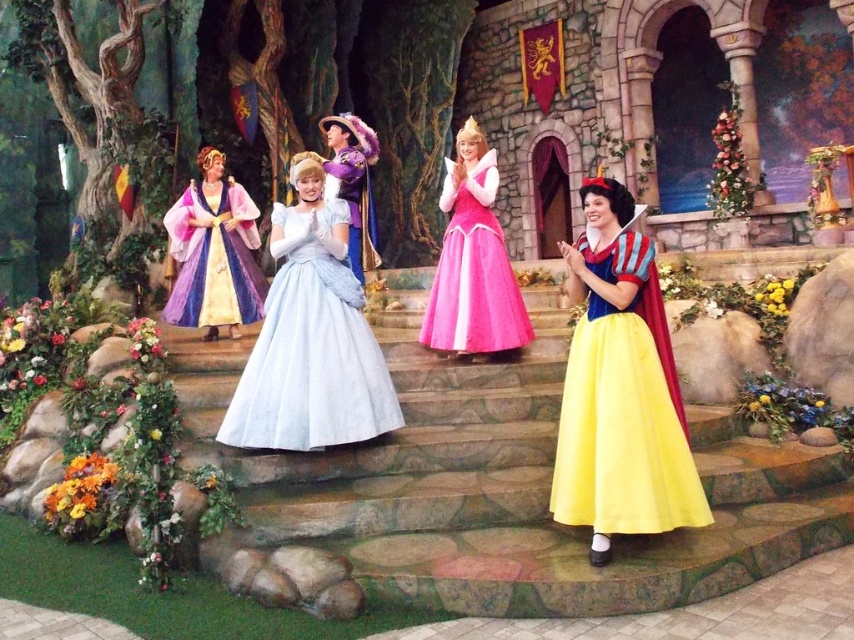
You are a photographer at the event and want to ensure both the yellow satin dress at center and the light blue satin dress at center are fully visible in your photo. Given their sizes, which dress might require you to adjust your camera angle to capture its entirety?

The light blue satin dress at center occupies more space than the yellow satin dress at center, so you may need to adjust your camera angle to ensure the light blue satin dress at center is fully visible.